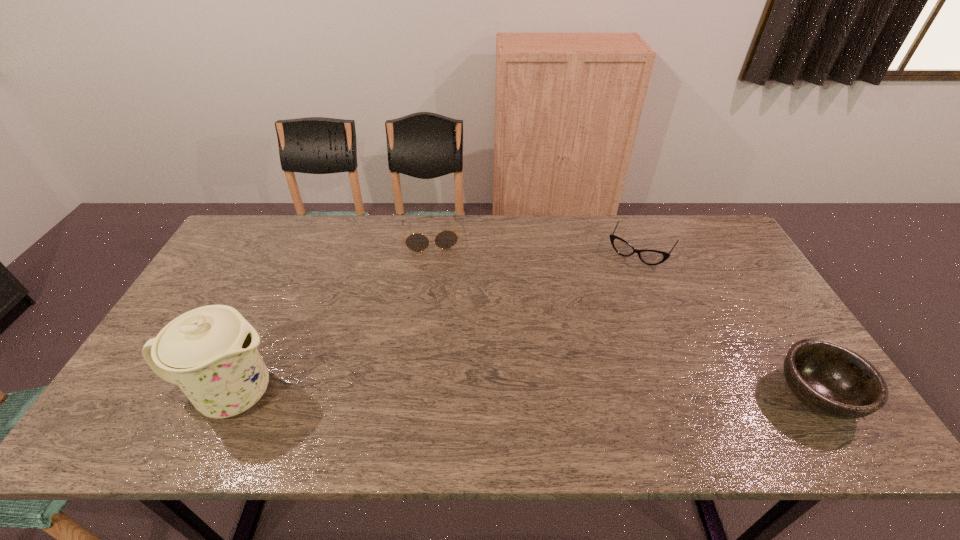
I want to click on free space between the bowl and the second object from right to left, so tap(728, 323).

Identify the location of vacant space in between the rightmost object and the second object from left to right. This screenshot has height=540, width=960. (624, 315).

At what (x,y) coordinates should I click in order to perform the action: click on vacant region between the sunglasses and the chinaware. Please return your answer as a coordinate pair (x, y). Image resolution: width=960 pixels, height=540 pixels. Looking at the image, I should click on (331, 315).

Where is `free space between the chinaware and the second object from right to left`? This screenshot has width=960, height=540. free space between the chinaware and the second object from right to left is located at coordinates (435, 323).

You are a GUI agent. You are given a task and a screenshot of the screen. Output one action in this format:
    pyautogui.click(x=<x>, y=<y>)
    Task: Click on the empty location between the third shortest object and the third object from left to right
    
    Given the screenshot: What is the action you would take?
    pyautogui.click(x=728, y=323)

This screenshot has height=540, width=960. I want to click on empty location between the sunglasses and the tallest object, so click(331, 315).

You are a GUI agent. You are given a task and a screenshot of the screen. Output one action in this format:
    pyautogui.click(x=<x>, y=<y>)
    Task: Click on the vacant area between the second object from right to left and the second tallest object
    
    Given the screenshot: What is the action you would take?
    pyautogui.click(x=728, y=323)

You are a GUI agent. You are given a task and a screenshot of the screen. Output one action in this format:
    pyautogui.click(x=<x>, y=<y>)
    Task: Click on the second closest object to the third object from right to left
    
    Given the screenshot: What is the action you would take?
    pyautogui.click(x=210, y=352)

Locate which object is the second closest to the second object from right to left. Please provide its 2D coordinates. Your answer should be formatted as a tuple, i.e. [(x, y)], where the tuple contains the x and y coordinates of a point satisfying the conditions above.

[(417, 242)]

Find the location of `blank space that satisfies the following two spatial constraints: 1. on the front side of the spectacles; 2. on the right side of the bowl`. blank space that satisfies the following two spatial constraints: 1. on the front side of the spectacles; 2. on the right side of the bowl is located at coordinates (699, 395).